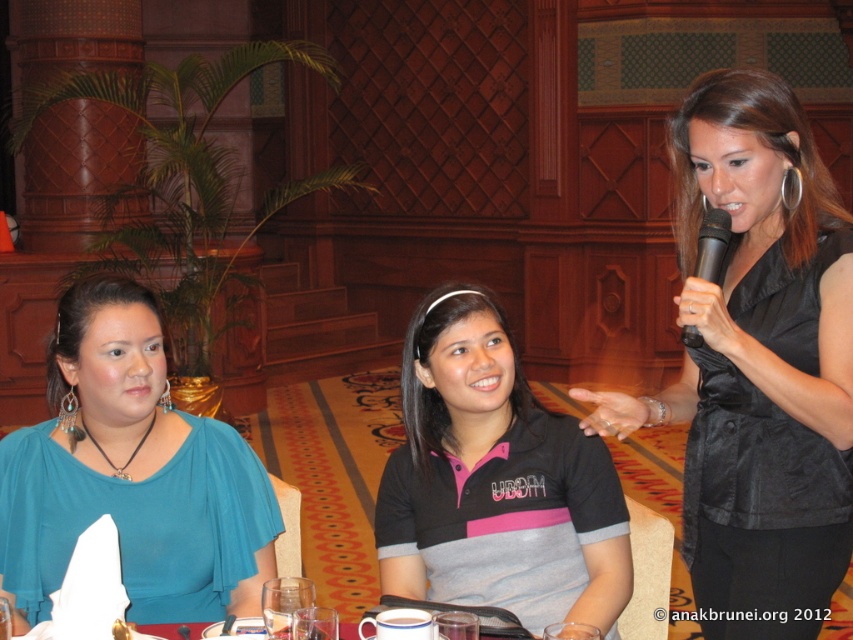
Does point (722, 173) lie in front of point (495, 305)?

Yes, it is.

Can you confirm if black satin vest at upper right is thinner than black matte polo shirt at center?

No.

Describe the element at coordinates (757, 364) in the screenshot. The width and height of the screenshot is (853, 640). I see `black satin vest at upper right` at that location.

Locate an element on the screen. The image size is (853, 640). black satin vest at upper right is located at coordinates (757, 364).

Between black matte polo shirt at center and black plastic microphone at upper right, which one appears on the left side from the viewer's perspective?

Positioned to the left is black matte polo shirt at center.

Can you confirm if black matte polo shirt at center is smaller than black plastic microphone at upper right?

Actually, black matte polo shirt at center might be larger than black plastic microphone at upper right.

This screenshot has height=640, width=853. What do you see at coordinates (495, 481) in the screenshot?
I see `black matte polo shirt at center` at bounding box center [495, 481].

This screenshot has height=640, width=853. Identify the location of black matte polo shirt at center. (495, 481).

Where is `teal fabric blouse at left`? The width and height of the screenshot is (853, 640). teal fabric blouse at left is located at coordinates (131, 474).

Which is more to the right, teal fabric blouse at left or black matte polo shirt at center?

Positioned to the right is black matte polo shirt at center.

Does point (207, 589) lie behind point (612, 625)?

That is True.

Locate an element on the screen. The width and height of the screenshot is (853, 640). teal fabric blouse at left is located at coordinates (131, 474).